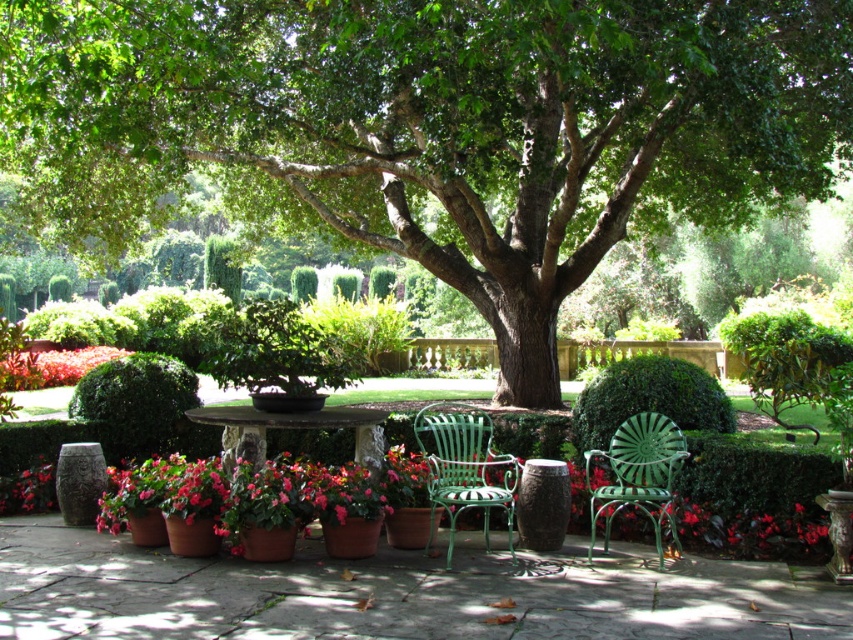
You are planning to host a small gathering in the garden. You need to place a large decorative statue that requires a space bigger than the stone table at center. Can the green textured hedge at center accommodate the statue?

The green textured hedge at center is larger in size than the stone table at center, so it can accommodate the statue since it has a bigger space available.

You are planning to set up a small garden party and want to place a decorative fountain in the garden. The fountain needs to be placed in front of the stone table at center so that guests can see it from the green textured hedge at center. Is the current arrangement allowing you to place the fountain there?

The stone table at center is behind the green textured hedge at center, so placing the fountain in front of the stone table at center would position it behind the green textured hedge at center. This means guests at the green textured hedge at center would not see the fountain. Therefore, the current arrangement does not allow placing the fountain there as desired.